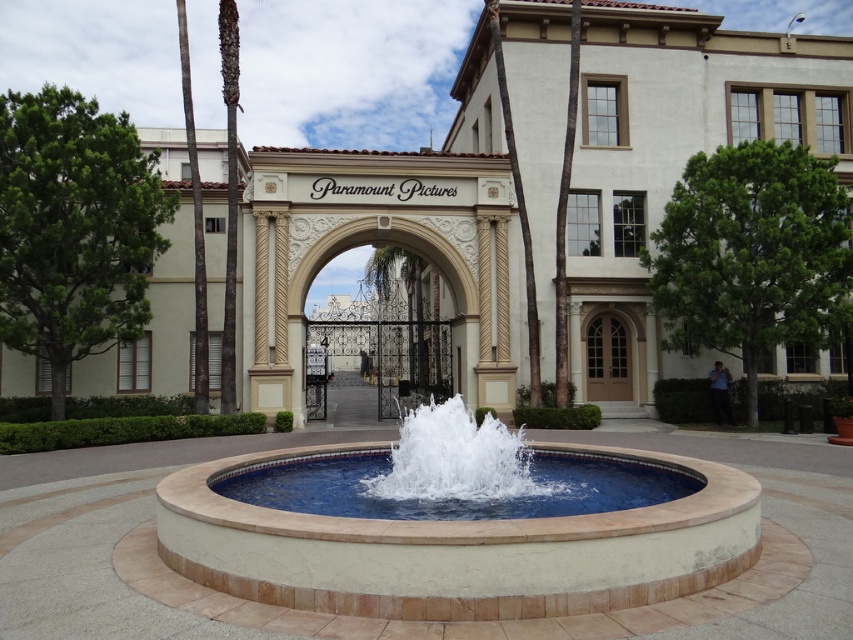
Question: Is green textured tree at left to the right of clear glass water at center from the viewer's perspective?

Choices:
 (A) no
 (B) yes

Answer: (A)

Question: Which point appears farthest from the camera in this image?

Choices:
 (A) (228, 384)
 (B) (439, 435)

Answer: (A)

Question: Which of the following is the farthest from the observer?

Choices:
 (A) green leafy palm tree at right
 (B) beige stone fountain at center
 (C) green textured tree at left

Answer: (C)

Question: In this image, where is white stucco building at center located relative to green leafy palm tree at left?

Choices:
 (A) left
 (B) right

Answer: (B)

Question: Which of these objects is positioned closest to the green textured tree at left?

Choices:
 (A) brown wooden door at center
 (B) green leafy palm tree at left

Answer: (B)

Question: Is white stucco building at center below green leafy palm tree at left?

Choices:
 (A) yes
 (B) no

Answer: (A)